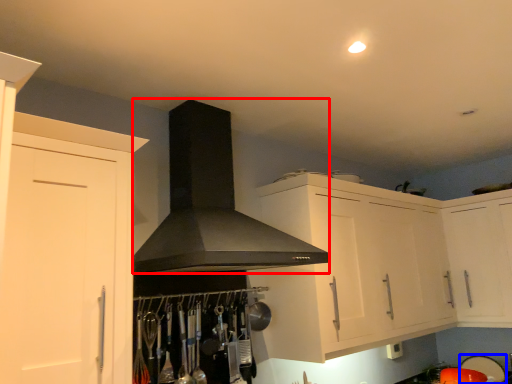
Question: Which of the following is the farthest to the observer, fume hood (highlighted by a red box) or appliance (highlighted by a blue box)?

Choices:
 (A) fume hood
 (B) appliance

Answer: (B)